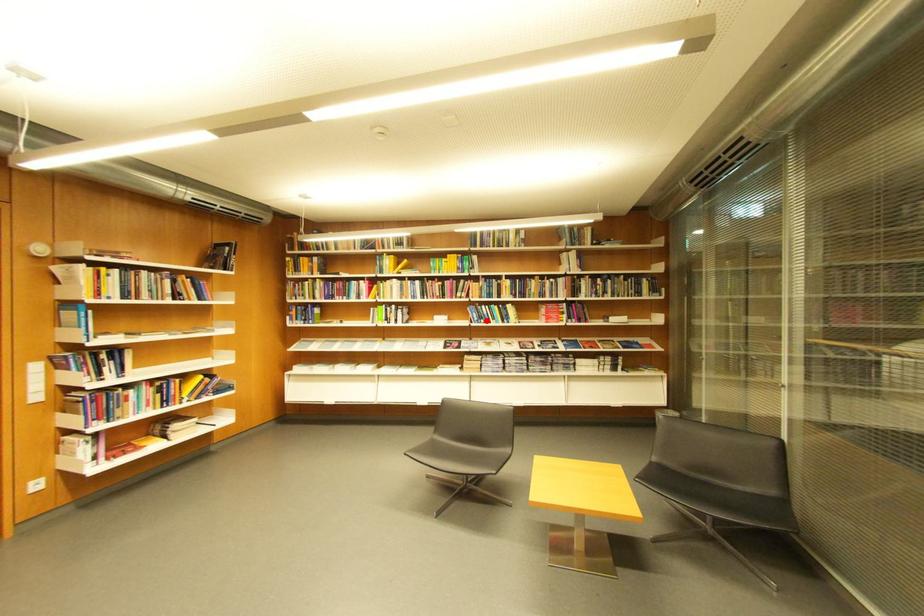
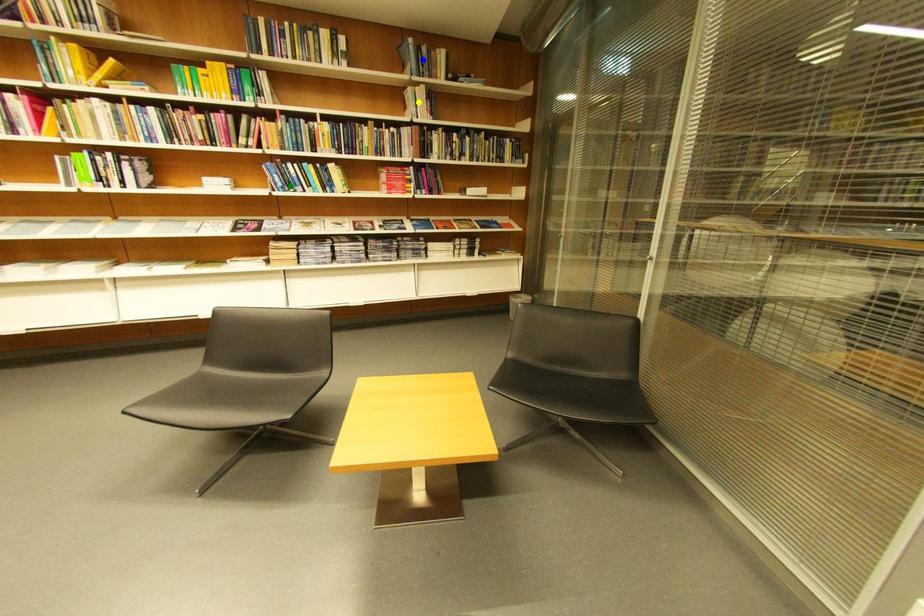
Question: I am providing you with two images of the same scene from different viewpoints. A red point is marked on the first image. You are given multiple points on the second image. Which point in image 2 represents the same 3d spot as the red point in image 1?

Choices:
 (A) green point
 (B) blue point
 (C) yellow point

Answer: (A)